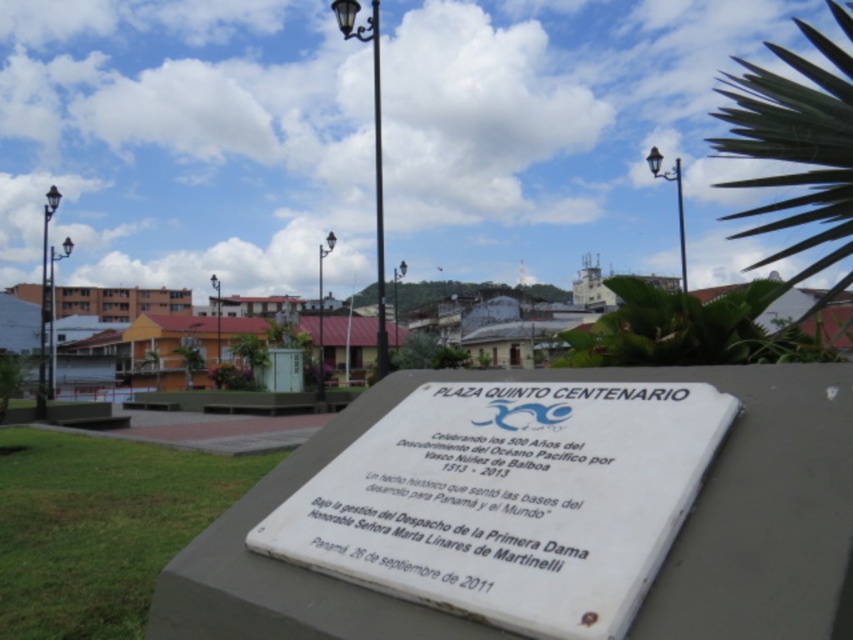
Is white marble plaque at center further to camera compared to white stone plaque at center?

No, it is in front of white stone plaque at center.

Can you confirm if white marble plaque at center is taller than white stone plaque at center?

Correct, white marble plaque at center is much taller as white stone plaque at center.

Identify the location of white marble plaque at center. The width and height of the screenshot is (853, 640). (509, 499).

Does metallic streetlight at left come behind metallic lamp post at upper center?

No, it is not.

Is point (44, 342) more distant than point (212, 280)?

No, it is in front of (212, 280).

Find the location of a particular element. Image resolution: width=853 pixels, height=640 pixels. metallic streetlight at left is located at coordinates (45, 305).

Find the location of `metallic streetlight at left`. metallic streetlight at left is located at coordinates (45, 305).

Is metallic streetlight at left smaller than metallic pole at upper center?

No, metallic streetlight at left is not smaller than metallic pole at upper center.

Does point (44, 296) lie behind point (317, 326)?

No, (44, 296) is in front of (317, 326).

Is point (48, 216) in front of point (318, 358)?

Yes, point (48, 216) is in front of point (318, 358).

This screenshot has height=640, width=853. I want to click on metallic streetlight at left, so click(x=45, y=305).